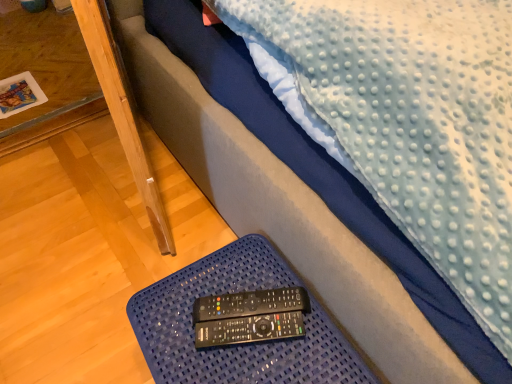
Question: In terms of height, does black plastic remote at lower center, which ranks as the 1th control in back-to-front order, look taller or shorter compared to black plastic remote at lower center, the 2th control when ordered from back to front?

Choices:
 (A) short
 (B) tall

Answer: (A)

Question: From the image's perspective, is black plastic remote at lower center, which is counted as the second control, starting from the front, above or below black plastic remote at lower center, the 2th control when ordered from back to front?

Choices:
 (A) above
 (B) below

Answer: (A)

Question: Based on their relative distances, which object is nearer to the blue textured tray at lower center?

Choices:
 (A) wooden table at lower left
 (B) black plastic remote at lower center, the 1th control viewed from the front
 (C) black plastic remote at lower center, which ranks as the 1th control in back-to-front order

Answer: (C)

Question: Considering the real-world distances, which object is closest to the wooden table at lower left?

Choices:
 (A) black plastic remote at lower center, which ranks as the 1th control in back-to-front order
 (B) black plastic remote at lower center, the 2th control when ordered from back to front
 (C) blue textured tray at lower center

Answer: (C)